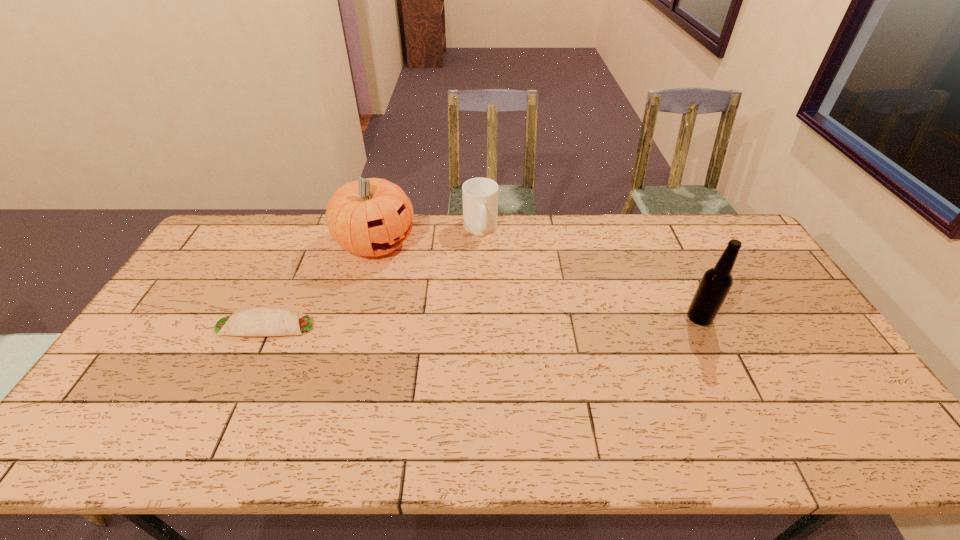
Locate an element on the screen. This screenshot has width=960, height=540. object that can be found as the third closest to the beer bottle is located at coordinates (257, 321).

Identify the location of free location that satisfies the following two spatial constraints: 1. on the front side of the mug; 2. on the left side of the beer bottle. Image resolution: width=960 pixels, height=540 pixels. (480, 318).

Locate an element on the screen. This screenshot has width=960, height=540. vacant region that satisfies the following two spatial constraints: 1. on the front side of the rightmost object; 2. on the right side of the pumpkin is located at coordinates (355, 318).

Find the location of a particular element. The image size is (960, 540). vacant space that satisfies the following two spatial constraints: 1. on the front side of the beer bottle; 2. on the right side of the third object from left to right is located at coordinates (480, 318).